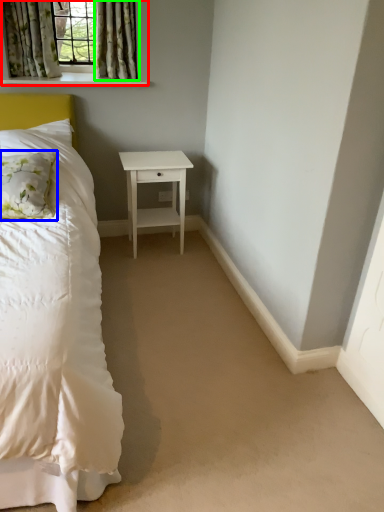
Question: Which object is positioned farthest from window (highlighted by a red box)? Select from pillow (highlighted by a blue box) and curtain (highlighted by a green box).

Choices:
 (A) pillow
 (B) curtain

Answer: (A)